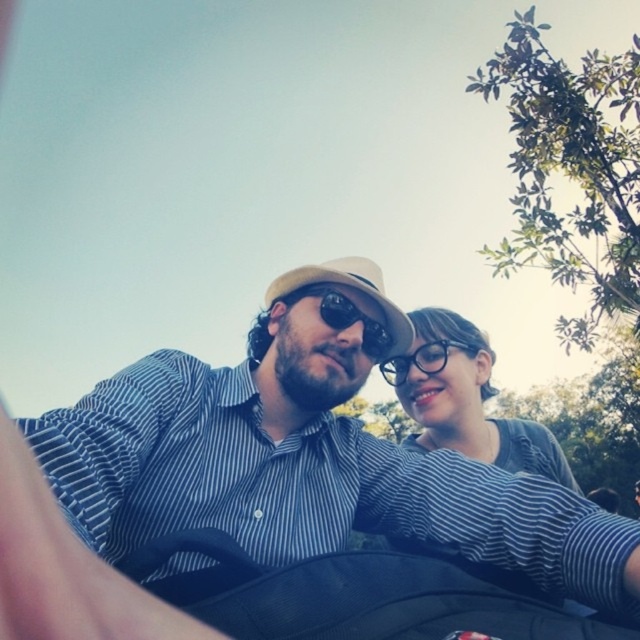
You are a photographer trying to capture a clear photo of the transparent plastic glasses at center. However, the blue striped shirt at center is blocking your view. Can you move the glasses to the side so they are no longer behind the shirt?

The blue striped shirt at center is in front of the transparent plastic glasses at center, so you cannot move the glasses to the side without adjusting their position relative to the shirt.

You are a photographer trying to focus on the blue striped shirt at center. The camera has a focus point at coordinate point (307, 460). Will this focus point be on the blue striped shirt at center?

Yes, the point (307, 460) is on the blue striped shirt at center, so the focus point will be on the blue striped shirt at center.